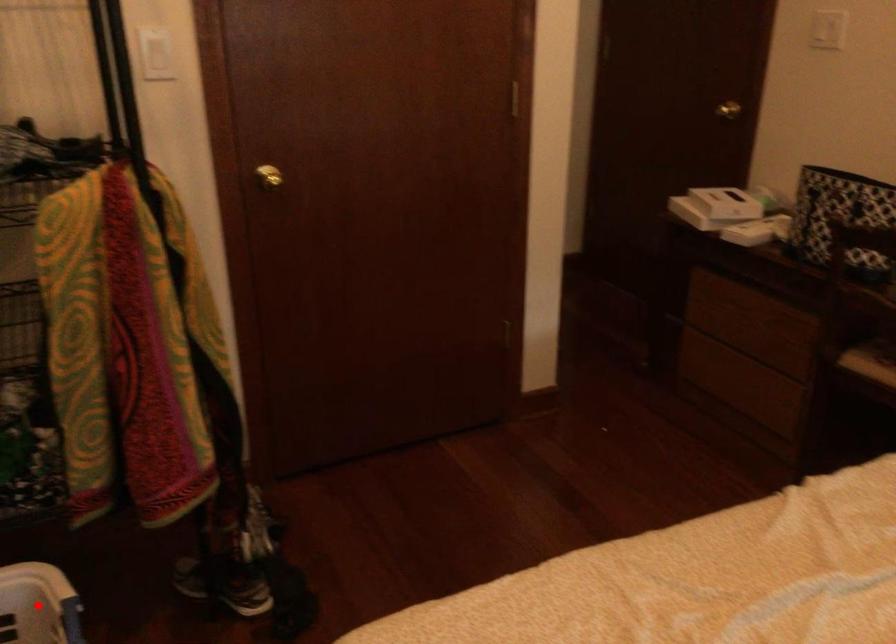
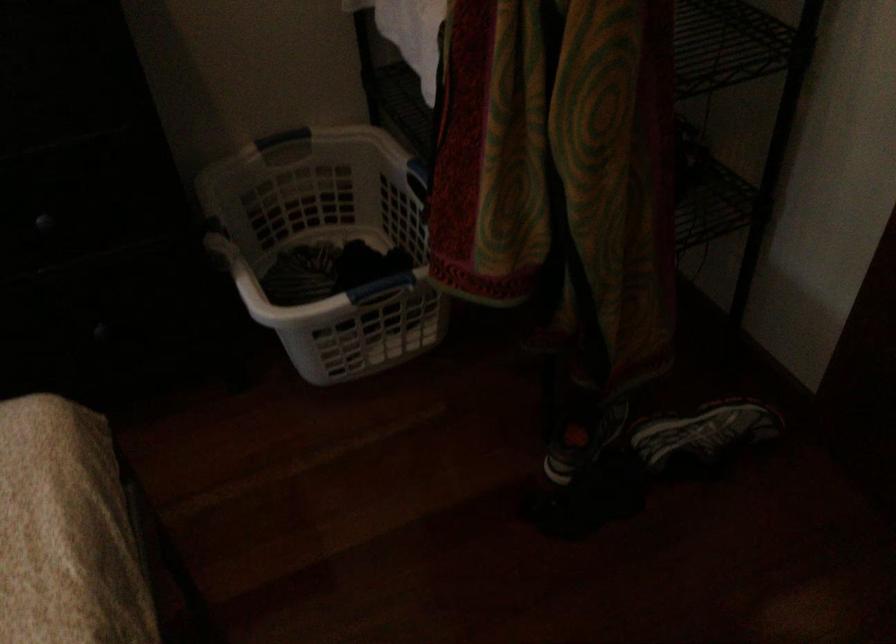
Question: I am providing you with two images of the same scene from different viewpoints. A red point is marked on the first image. Can you still see the location of the red point in image 2?

Choices:
 (A) Yes
 (B) No

Answer: (B)